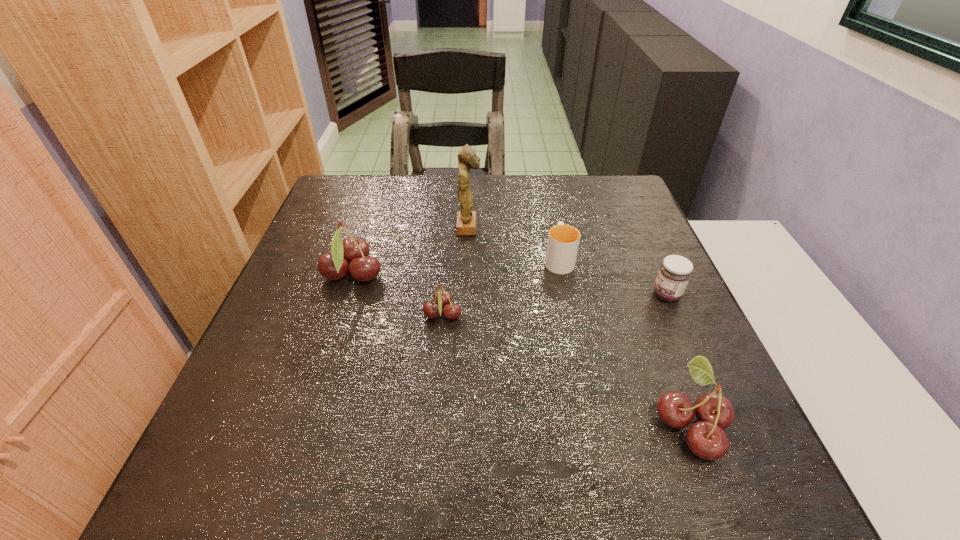
This screenshot has width=960, height=540. Find the location of `vacant position located on the leaves of the nearest object`. vacant position located on the leaves of the nearest object is located at coordinates (455, 424).

Where is `vacant space located 0.400m on the leaves of the nearest object`? Image resolution: width=960 pixels, height=540 pixels. vacant space located 0.400m on the leaves of the nearest object is located at coordinates 420,424.

Identify the location of vacant space situated 0.230m on the leaves of the nearest object. The height and width of the screenshot is (540, 960). (520, 424).

Locate an element on the screen. Image resolution: width=960 pixels, height=540 pixels. free location located 0.360m on the front-facing side of the tallest object is located at coordinates (615, 227).

Locate an element on the screen. The image size is (960, 540). vacant space located 0.320m on the front label of the jam is located at coordinates (509, 295).

The width and height of the screenshot is (960, 540). What are the coordinates of `free space located 0.090m on the front label of the jam` in the screenshot? It's located at (612, 295).

Locate an element on the screen. vacant space situated on the front label of the jam is located at coordinates (495, 295).

Where is `free space located with the handle on the side of the cup`? free space located with the handle on the side of the cup is located at coordinates (550, 217).

The width and height of the screenshot is (960, 540). I want to click on free spot located 0.250m with the handle on the side of the cup, so click(545, 193).

At what (x,y) coordinates should I click in order to perform the action: click on vacant space located with the handle on the side of the cup. Please return your answer as a coordinate pair (x, y). This screenshot has height=540, width=960. Looking at the image, I should click on (550, 218).